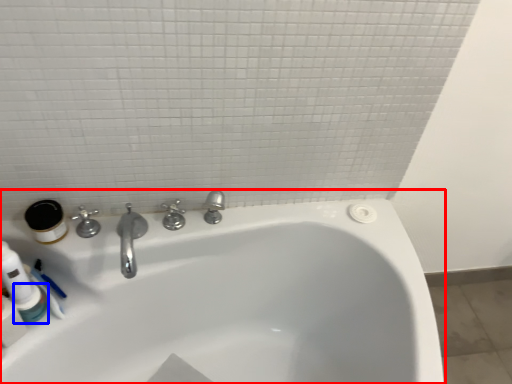
Question: Which of the following is the farthest to the observer, bathtub (highlighted by a red box) or mouthwash (highlighted by a blue box)?

Choices:
 (A) bathtub
 (B) mouthwash

Answer: (B)